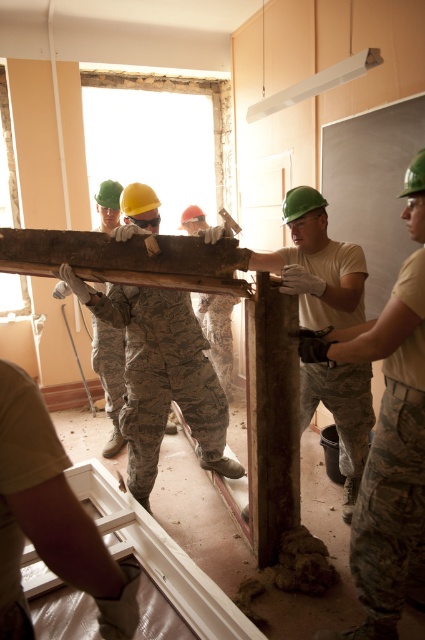
Question: Which of the following is the closest to the observer?

Choices:
 (A) (408, 204)
 (B) (342, 243)

Answer: (A)

Question: Is camouflage fabric uniform at center bigger than rusty metal pole at center?

Choices:
 (A) no
 (B) yes

Answer: (B)

Question: Among these objects, which one is nearest to the camera?

Choices:
 (A) rusty metal pole at center
 (B) camouflage fabric uniform at center
 (C) matte green helmet at center

Answer: (C)

Question: Does matte green helmet at center come behind rusty metal pole at center?

Choices:
 (A) yes
 (B) no

Answer: (B)

Question: Is matte green helmet at center closer to camera compared to camouflage fabric uniform at center?

Choices:
 (A) no
 (B) yes

Answer: (B)

Question: Estimate the real-world distances between objects in this image. Which object is farther from the matte green helmet at center?

Choices:
 (A) rusty metal pole at center
 (B) camouflage fabric uniform at center

Answer: (B)